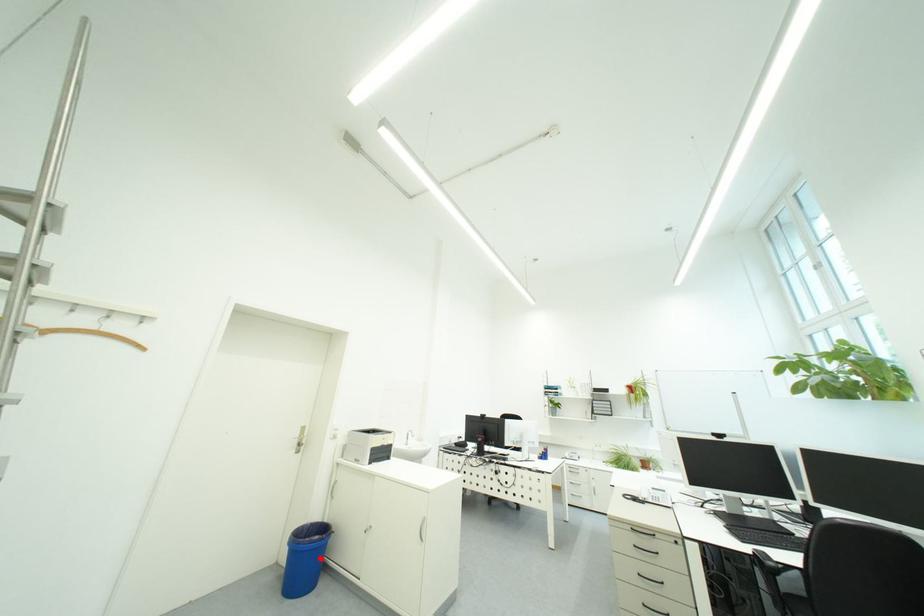
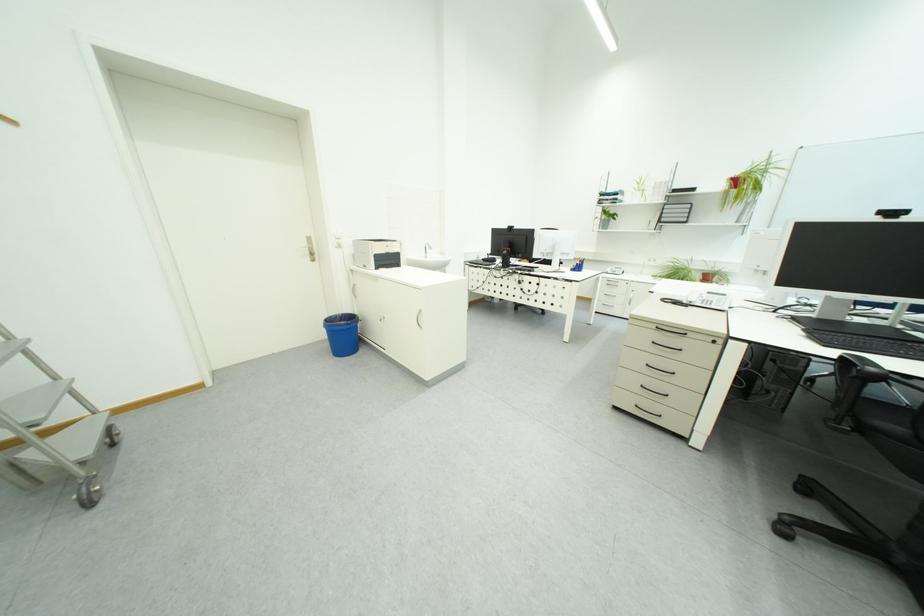
Find the pixel in the second image that matches the highlighted location in the first image.

(358, 336)